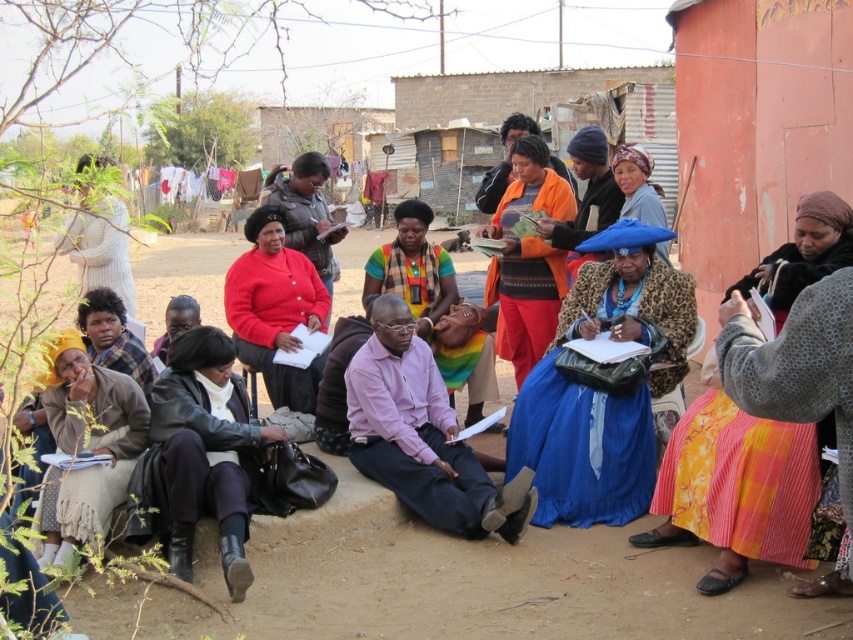
Is blue leopard print coat at center bigger than matte plaid shirt at lower left?

Yes, blue leopard print coat at center is bigger than matte plaid shirt at lower left.

Does blue leopard print coat at center come in front of matte plaid shirt at lower left?

Yes, it is.

Does point (564, 456) come behind point (125, 316)?

That is False.

Image resolution: width=853 pixels, height=640 pixels. I want to click on blue leopard print coat at center, so click(604, 385).

Measure the distance between point (x=802, y=436) and camera.

A distance of 16.51 feet exists between point (x=802, y=436) and camera.

Between point (749, 508) and point (633, 211), which one is positioned in front?

Positioned in front is point (749, 508).

What are the coordinates of `yellow printed skirt at lower right` in the screenshot? It's located at (735, 484).

Can you confirm if multicolored woven fabric at center is positioned to the left of blue fabric hat at upper center?

Yes, multicolored woven fabric at center is to the left of blue fabric hat at upper center.

Describe the element at coordinates (434, 305) in the screenshot. I see `multicolored woven fabric at center` at that location.

Measure the distance between point (465, 355) and camera.

Point (465, 355) is 7.76 meters from camera.

Locate an element on the screen. The width and height of the screenshot is (853, 640). multicolored woven fabric at center is located at coordinates (434, 305).